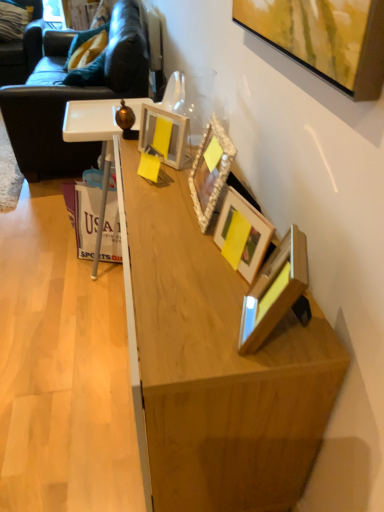
Where is `free spot in front of matte yellow picture frame at center, positioned as the fourth picture frame in front-to-back order`? free spot in front of matte yellow picture frame at center, positioned as the fourth picture frame in front-to-back order is located at coordinates (159, 178).